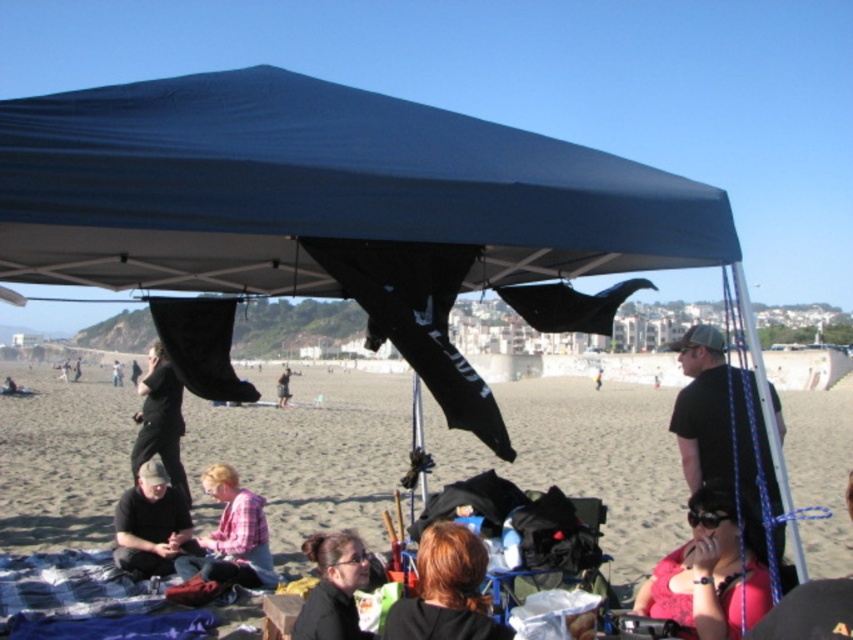
Does beige sand at lower center appear on the left side of dark gray fabric cap at lower left?

Correct, you'll find beige sand at lower center to the left of dark gray fabric cap at lower left.

You are a GUI agent. You are given a task and a screenshot of the screen. Output one action in this format:
    pyautogui.click(x=<x>, y=<y>)
    Task: Click on the beige sand at lower center
    
    Given the screenshot: What is the action you would take?
    pyautogui.click(x=309, y=452)

Does beige sand at lower center have a greater width compared to black matte hair at lower center?

Indeed, beige sand at lower center has a greater width compared to black matte hair at lower center.

Who is more forward, (344,428) or (340,563)?

Positioned in front is point (340,563).

Which is behind, point (651, 493) or point (344, 632)?

Positioned behind is point (651, 493).

Locate an element on the screen. beige sand at lower center is located at coordinates (309, 452).

Can you confirm if dark gray fabric pants at lower left is positioned to the left of black fabric at center?

No, dark gray fabric pants at lower left is not to the left of black fabric at center.

Does dark gray fabric pants at lower left have a lesser width compared to black fabric at center?

Yes.

Which is behind, point (158, 412) or point (114, 362)?

Point (114, 362)

Locate an element on the screen. This screenshot has width=853, height=640. dark gray fabric pants at lower left is located at coordinates (160, 420).